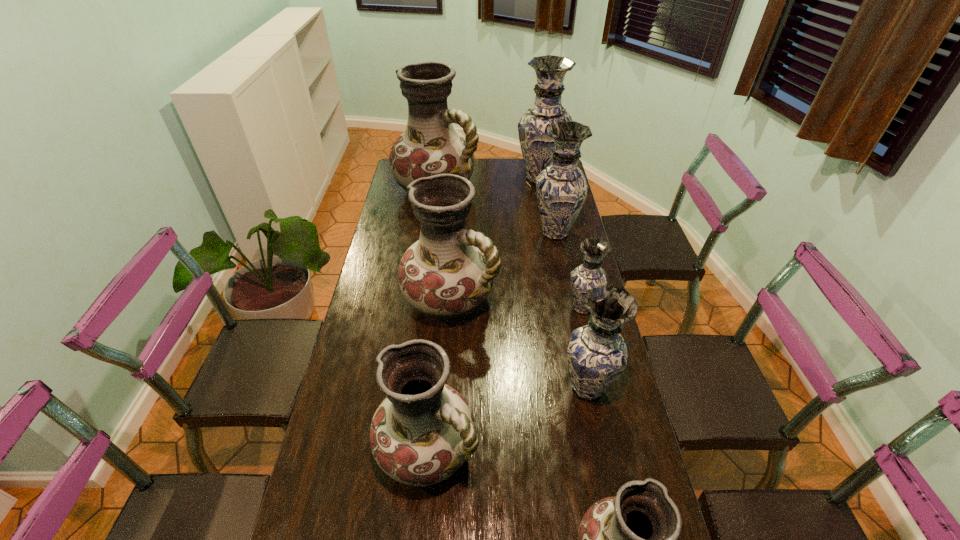
Find the location of a particular element. vacant point located on the back of the second farthest red vase is located at coordinates (454, 253).

Find the location of a particular element. The width and height of the screenshot is (960, 540). free region located on the left of the sixth nearest object is located at coordinates (443, 233).

Identify the location of free space located on the back of the second nearest red vase. The image size is (960, 540). (437, 352).

Find the location of a particular element. This screenshot has width=960, height=540. free region located on the left of the nearest blue vase is located at coordinates (421, 388).

The width and height of the screenshot is (960, 540). In order to click on vacant region located 0.060m on the left of the smallest blue vase in this screenshot , I will do `click(548, 308)`.

This screenshot has width=960, height=540. I want to click on object located in the far left corner section of the desktop, so click(430, 145).

Image resolution: width=960 pixels, height=540 pixels. What are the coordinates of `object positioned at the far right corner` in the screenshot? It's located at (536, 145).

This screenshot has height=540, width=960. What are the coordinates of `vacant space at the far edge` in the screenshot? It's located at (492, 165).

The image size is (960, 540). In order to click on vacant space at the left edge of the desktop in this screenshot , I will do `click(369, 518)`.

I want to click on empty space between the farthest red vase and the nearest blue vase, so click(x=512, y=289).